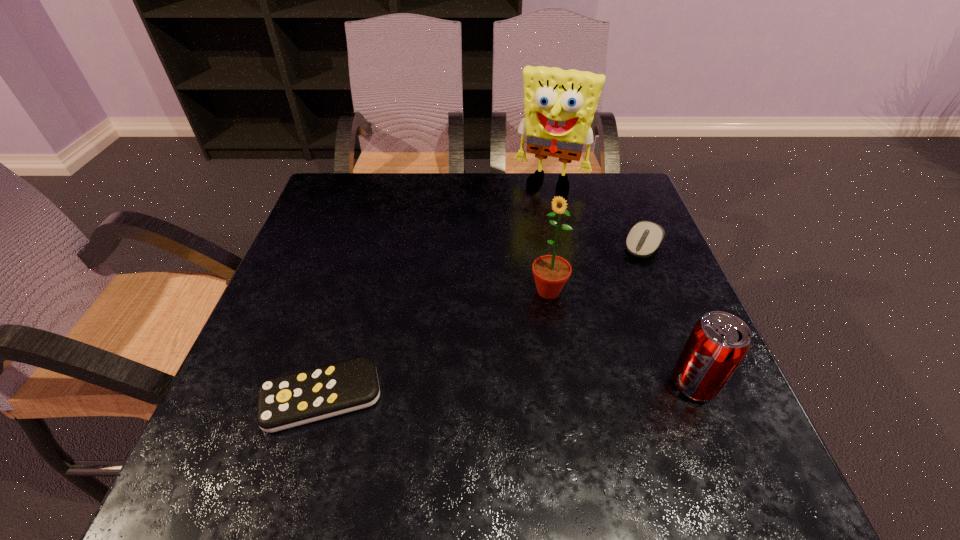
Locate an element on the screen. The height and width of the screenshot is (540, 960). free space between the farthest object and the second shortest object is located at coordinates (597, 214).

Locate an element on the screen. free space that is in between the leftmost object and the third shortest object is located at coordinates (508, 390).

Image resolution: width=960 pixels, height=540 pixels. I want to click on vacant space in between the farthest object and the computer equipment, so click(597, 214).

Image resolution: width=960 pixels, height=540 pixels. Identify the location of vacant space in between the remote control and the sponge. (437, 291).

This screenshot has height=540, width=960. Identify the location of unoccupied position between the computer equipment and the third tallest object. (668, 315).

The image size is (960, 540). Find the location of `vacant region between the third tallest object and the third nearest object`. vacant region between the third tallest object and the third nearest object is located at coordinates (621, 338).

I want to click on object that is the fourth closest one to the leftmost object, so click(560, 104).

What are the coordinates of `object that can be found as the second closest to the third farthest object` in the screenshot? It's located at (718, 342).

I want to click on free space that satisfies the following two spatial constraints: 1. on the back side of the sunflower; 2. on the right side of the computer equipment, so click(x=541, y=245).

You are a GUI agent. You are given a task and a screenshot of the screen. Output one action in this format:
    pyautogui.click(x=<x>, y=<y>)
    Task: Click on the vacant point that satisfies the following two spatial constraints: 1. on the front side of the sunflower; 2. on the right side of the third shortest object
    The height and width of the screenshot is (540, 960).
    Given the screenshot: What is the action you would take?
    pyautogui.click(x=563, y=384)